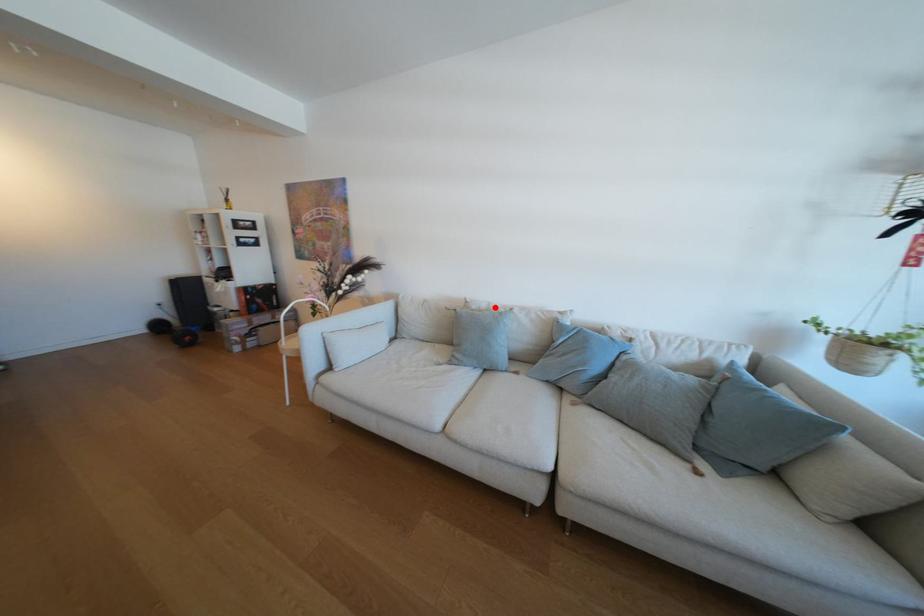
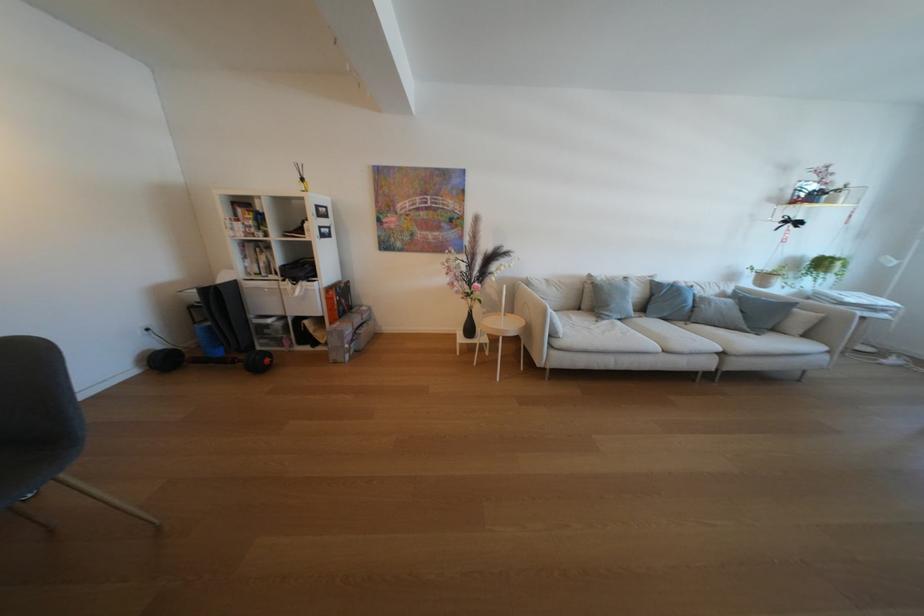
Question: I am providing you with two images of the same scene from different viewpoints. In image1, a red point is highlighted. Considering the same 3D point in image2, which of the following is correct?

Choices:
 (A) It is closer
 (B) It is farther

Answer: (A)